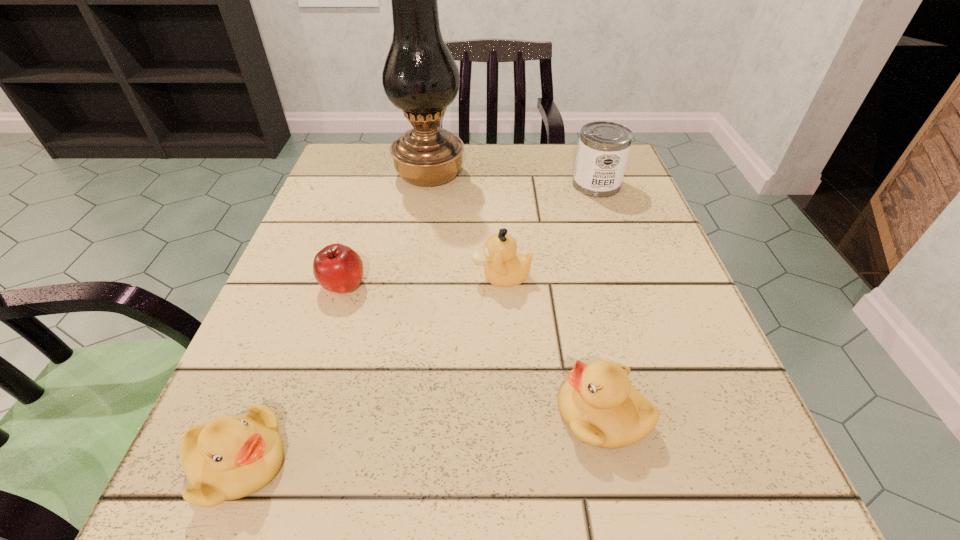
At what (x,y) coordinates should I click in order to perform the action: click on apple that is at the left edge. Please return your answer as a coordinate pair (x, y). Looking at the image, I should click on (337, 268).

Where is `duckling present at the left edge`? Image resolution: width=960 pixels, height=540 pixels. duckling present at the left edge is located at coordinates (231, 457).

In order to click on can at the right edge in this screenshot , I will do `click(603, 149)`.

Identify the location of duckling situated at the right edge. The height and width of the screenshot is (540, 960). (598, 403).

This screenshot has width=960, height=540. Identify the location of object at the far left corner. (420, 77).

Identify the location of object located in the near left corner section of the desktop. The width and height of the screenshot is (960, 540). (231, 457).

Find the location of a particular element. object present at the far right corner is located at coordinates (603, 149).

Where is `object that is at the near right corner`? The width and height of the screenshot is (960, 540). object that is at the near right corner is located at coordinates (598, 403).

Image resolution: width=960 pixels, height=540 pixels. What are the coordinates of `vacant space at the far edge of the desktop` in the screenshot? It's located at (529, 195).

In the image, there is a desktop. Where is `vacant space at the near edge`? The height and width of the screenshot is (540, 960). vacant space at the near edge is located at coordinates (624, 517).